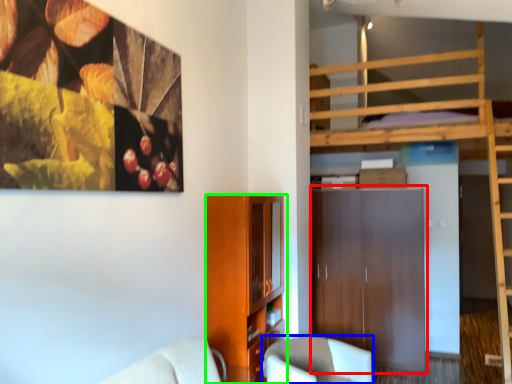
Question: Estimate the real-world distances between objects in this image. Which object is closer to dresser (highlighted by a red box), chair (highlighted by a blue box) or cabinetry (highlighted by a green box)?

Choices:
 (A) chair
 (B) cabinetry

Answer: (A)